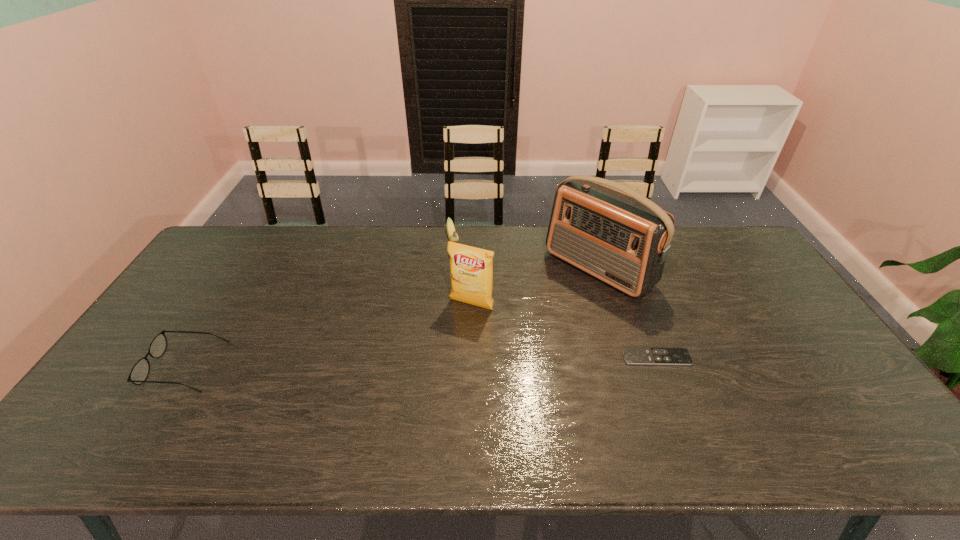
Where is `vacant point located on the front of the crisp (potato chip) with the logo`? Image resolution: width=960 pixels, height=540 pixels. vacant point located on the front of the crisp (potato chip) with the logo is located at coordinates (416, 397).

Identify the location of vacant area situated 0.100m on the front-facing side of the tallest object. (549, 309).

Identify the location of free spot located 0.120m on the front-facing side of the tallest object. The image size is (960, 540). (544, 313).

The width and height of the screenshot is (960, 540). I want to click on blank space located 0.260m on the front-facing side of the tallest object, so click(x=514, y=339).

At what (x,y) coordinates should I click in order to perform the action: click on vacant position located at the stem of the third shortest object. Please return your answer as a coordinate pair (x, y). Looking at the image, I should click on (472, 326).

Locate an element on the screen. vacant space positioned at the stem of the third shortest object is located at coordinates (456, 264).

Image resolution: width=960 pixels, height=540 pixels. Identify the location of vacant area situated 0.220m at the stem of the third shortest object. (464, 296).

Locate an element on the screen. radio receiver at the far edge is located at coordinates (623, 239).

At what (x,y) coordinates should I click in order to perform the action: click on banana located in the far edge section of the desktop. Please return your answer as a coordinate pair (x, y). Looking at the image, I should click on (452, 234).

Where is `object at the near edge`? object at the near edge is located at coordinates (140, 371).